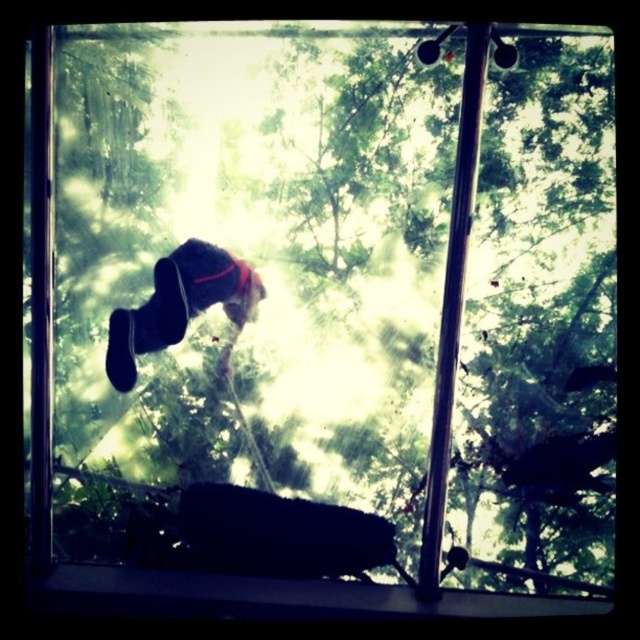
Does black plastic window sill at lower center have a smaller size compared to black suede shoes at center?

Actually, black plastic window sill at lower center might be larger than black suede shoes at center.

Looking at this image, who is shorter, black plastic window sill at lower center or black suede shoes at center?

black plastic window sill at lower center is shorter.

Which is in front, point (128, 589) or point (134, 317)?

Positioned in front is point (128, 589).

You are a GUI agent. You are given a task and a screenshot of the screen. Output one action in this format:
    pyautogui.click(x=<x>, y=<y>)
    Task: Click on the black plastic window sill at lower center
    
    Given the screenshot: What is the action you would take?
    pyautogui.click(x=269, y=596)